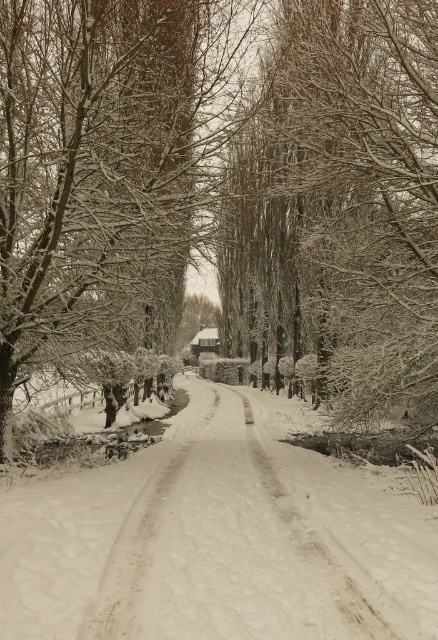
Can you confirm if snow-covered branches at center is shorter than white snow-covered path at center?

In fact, snow-covered branches at center may be taller than white snow-covered path at center.

Between point (123, 228) and point (129, 604), which one is positioned behind?

Point (123, 228)

This screenshot has width=438, height=640. Identify the location of snow-covered branches at center. (222, 188).

The width and height of the screenshot is (438, 640). Identify the location of snow-covered trees at center. (342, 204).

Is snow-covered trees at center to the right of white snow-covered path at center from the viewer's perspective?

Yes, snow-covered trees at center is to the right of white snow-covered path at center.

Who is more forward, (341, 346) or (201, 499)?

Point (201, 499) is more forward.

Locate an element on the screen. snow-covered trees at center is located at coordinates (342, 204).

Which is below, snow-covered branches at center or snow-covered trees at center?

Positioned lower is snow-covered branches at center.

How much distance is there between snow-covered branches at center and snow-covered trees at center?

1.22 meters

Is point (303, 182) farther from camera compared to point (239, 259)?

No, it is in front of (239, 259).

Locate an element on the screen. snow-covered branches at center is located at coordinates (222, 188).